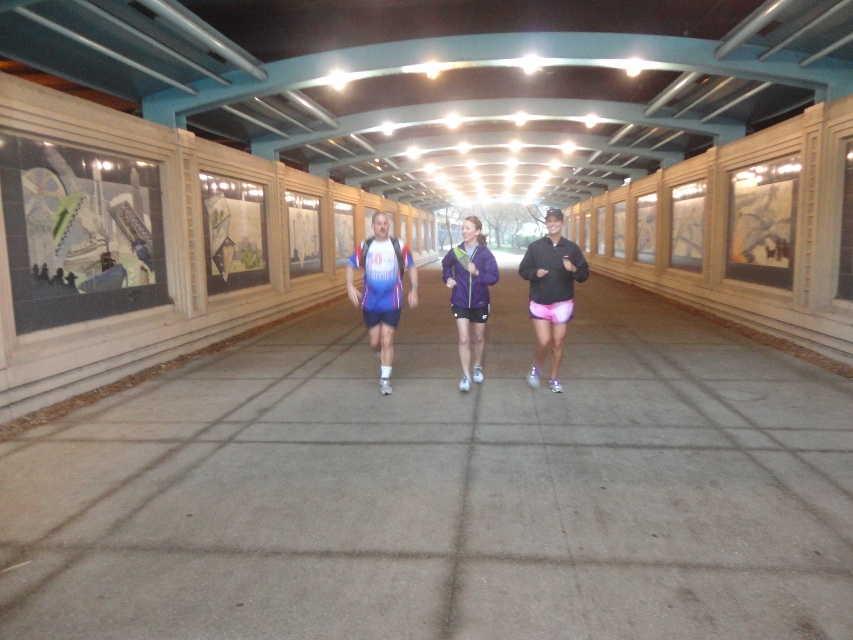
Which is behind, point (544, 305) or point (462, 333)?

The point (462, 333) is more distant.

Can you confirm if pink fabric shorts at center is taller than purple matte jacket at center?

Correct, pink fabric shorts at center is much taller as purple matte jacket at center.

Which is behind, point (538, 276) or point (476, 240)?

Positioned behind is point (476, 240).

Where is `pink fabric shorts at center`? The image size is (853, 640). pink fabric shorts at center is located at coordinates (550, 291).

You are a GUI agent. You are given a task and a screenshot of the screen. Output one action in this format:
    pyautogui.click(x=<x>, y=<y>)
    Task: Click on the pink fabric shorts at center
    The height and width of the screenshot is (640, 853).
    Given the screenshot: What is the action you would take?
    pyautogui.click(x=550, y=291)

Can you confirm if pink fabric shorts at center is smaller than matte blue and white running shirt at center?

Incorrect, pink fabric shorts at center is not smaller in size than matte blue and white running shirt at center.

Does point (552, 330) lie in front of point (386, 378)?

That is True.

Find the location of `pink fabric shorts at center`. pink fabric shorts at center is located at coordinates (550, 291).

Is matte blue and white running shirt at center to the right of purple matte jacket at center from the viewer's perspective?

Incorrect, matte blue and white running shirt at center is not on the right side of purple matte jacket at center.

At what (x,y) coordinates should I click in order to perform the action: click on matte blue and white running shirt at center. Please return your answer as a coordinate pair (x, y). The image size is (853, 640). Looking at the image, I should click on (381, 289).

Locate an element on the screen. matte blue and white running shirt at center is located at coordinates (381, 289).